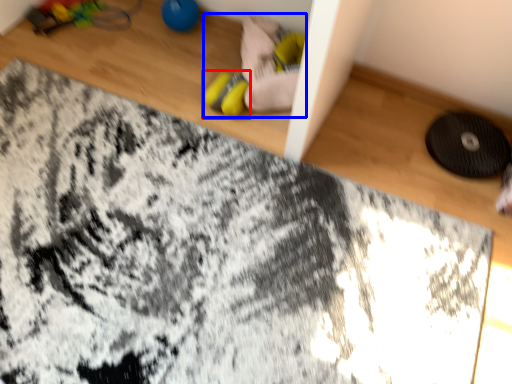
Question: Among these objects, which one is nearest to the camera, footwear (highlighted by a red box) or toy (highlighted by a blue box)?

Choices:
 (A) footwear
 (B) toy

Answer: (B)